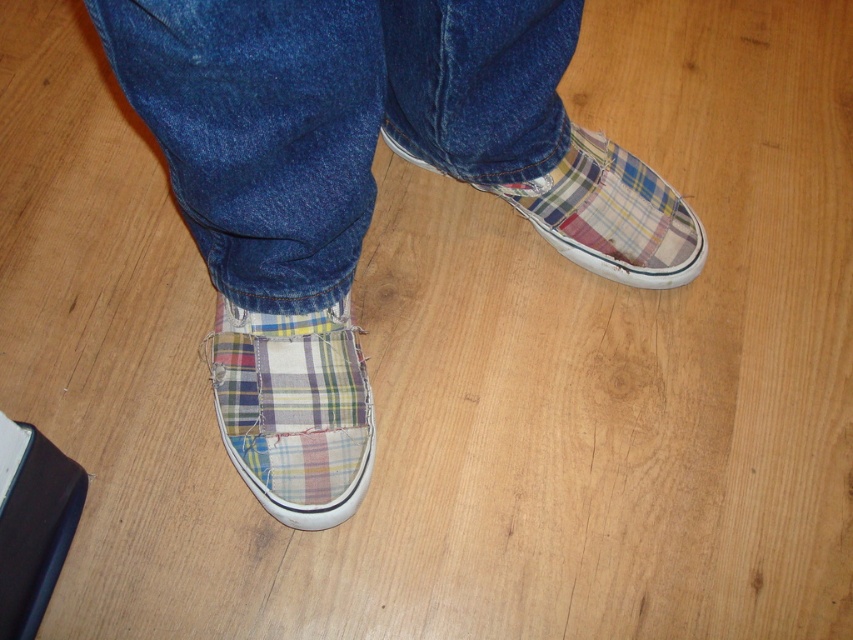
You are a fashion designer analyzing the placement of elements in the image. The coordinates point to a specific location. Which object is located at the coordinates point (x=294, y=410)?

The point (x=294, y=410) corresponds to the plaid fabric slip on shoe at lower center.

You are a photographer setting up a shot of a person wearing slipper sneakers with patchwork plaid designs. You need to ensure the focus is sharp at the point 3.54 feet away from the camera. The scene includes the person standing on a wooden floor with blue jeans rolled up at the ankles. Where should you set the focus distance on your camera to ensure the point at point (225,422) is in sharp focus?

You should set the focus distance on your camera to 3.54 feet because the point (225,422) is exactly 3.54 feet away from the camera, ensuring sharp focus at that location.